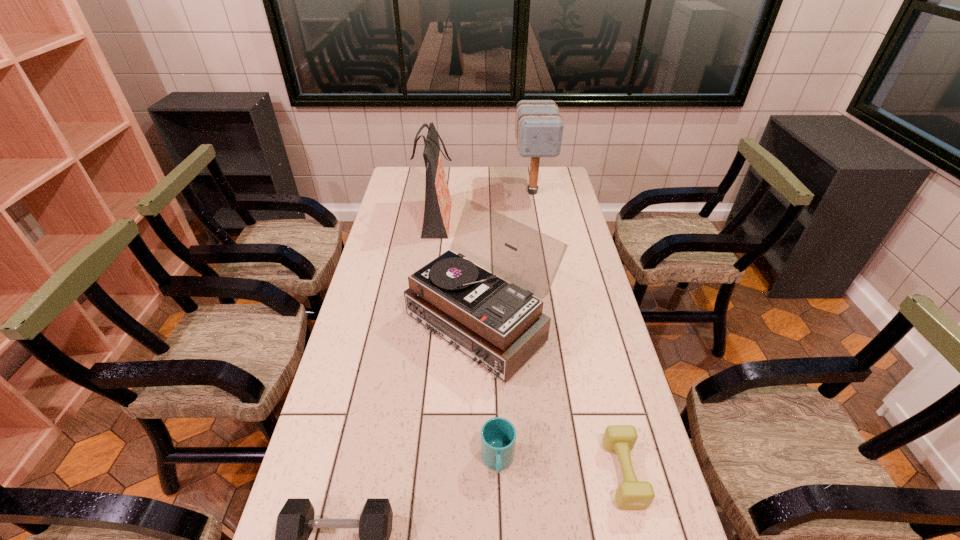
Locate an element on the screen. The height and width of the screenshot is (540, 960). shopping bag is located at coordinates (437, 210).

The width and height of the screenshot is (960, 540). Identify the location of mallet. (539, 127).

At what (x,y) coordinates should I click in order to perform the action: click on the fourth nearest object. Please return your answer as a coordinate pair (x, y). Looking at the image, I should click on (499, 325).

You are a GUI agent. You are given a task and a screenshot of the screen. Output one action in this format:
    pyautogui.click(x=<x>, y=<y>)
    Task: Click on the fourth shortest object
    
    Given the screenshot: What is the action you would take?
    pyautogui.click(x=499, y=325)

Identify the location of cup. (498, 435).

The width and height of the screenshot is (960, 540). Identify the location of the right dumbbell. (632, 494).

Find the location of a particular element. the farther dumbbell is located at coordinates (632, 494).

Identify the location of free spot located on the front side of the shopping bag. (486, 221).

Find the location of a particular element. The width and height of the screenshot is (960, 540). vacant space located on the striking surface of the mallet is located at coordinates (544, 261).

This screenshot has height=540, width=960. What are the coordinates of `vacant region located on the back of the third tallest object` in the screenshot? It's located at (481, 232).